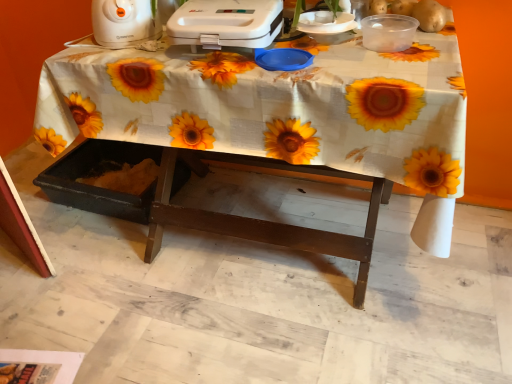
Identify the location of free space in front of white plastic toaster at upper left, arranged as the 2th appliance when viewed from the right. (123, 60).